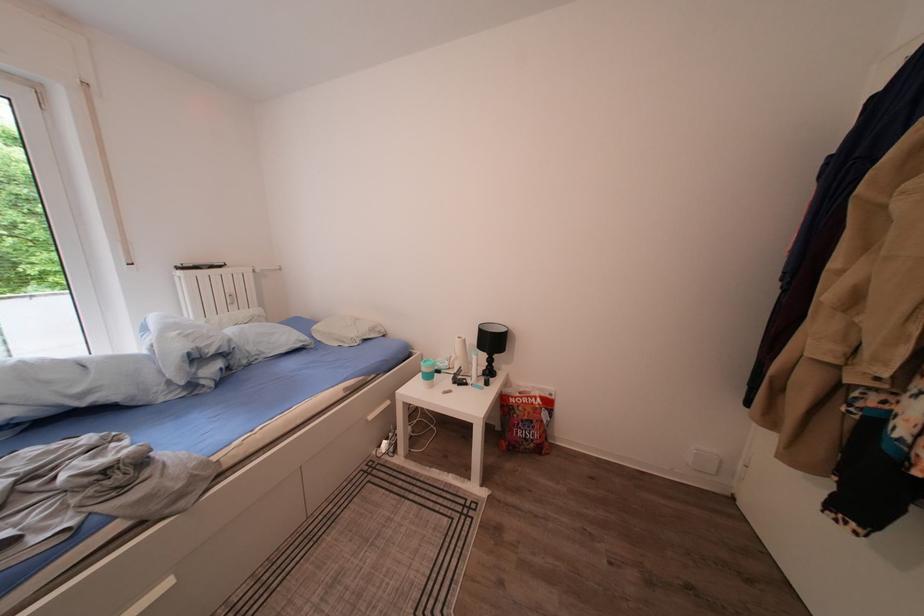
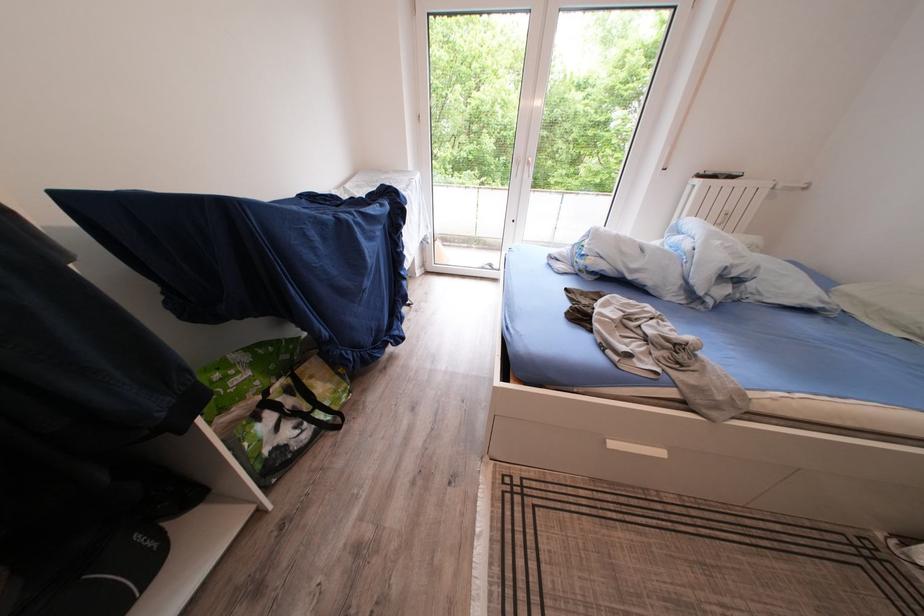
Based on the continuous images, in which direction is the camera rotating?

The rotation direction of the camera is left-down.